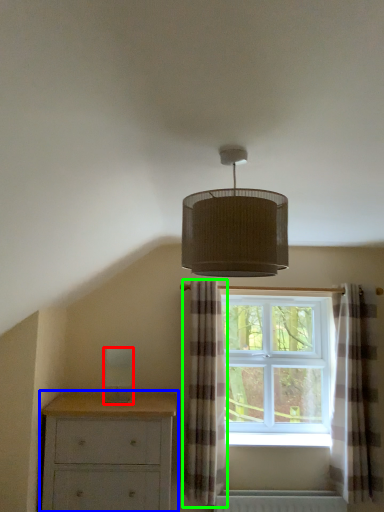
Question: Estimate the real-world distances between objects in this image. Which object is closer to light fixture (highlighted by a red box), chest of drawers (highlighted by a blue box) or curtain (highlighted by a green box)?

Choices:
 (A) chest of drawers
 (B) curtain

Answer: (A)